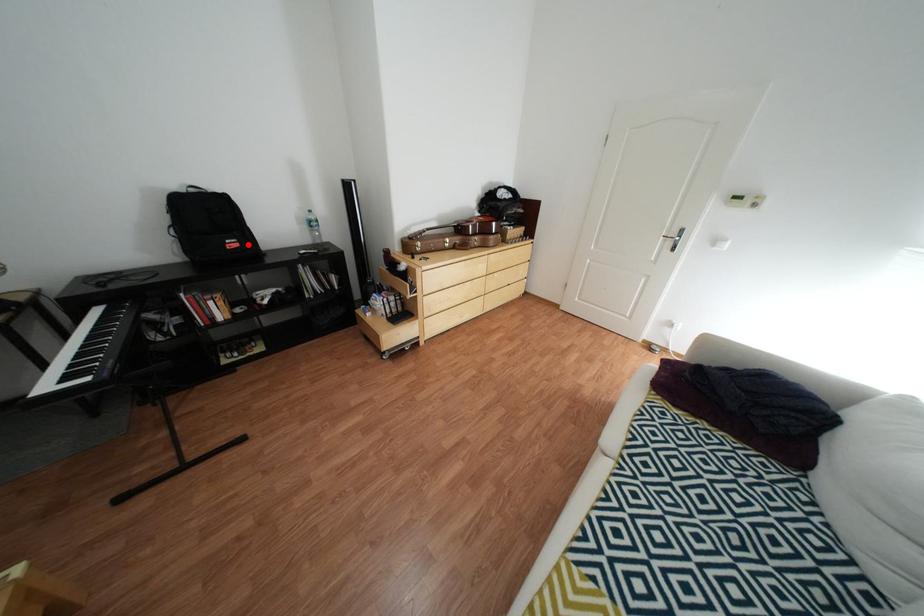
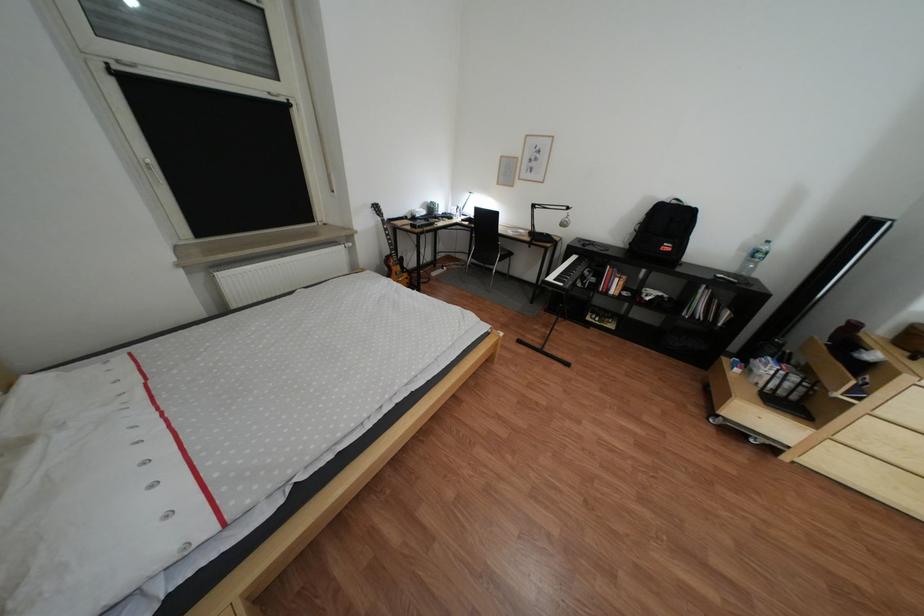
In the second image, find the point that corresponds to the highlighted location in the first image.

(683, 248)